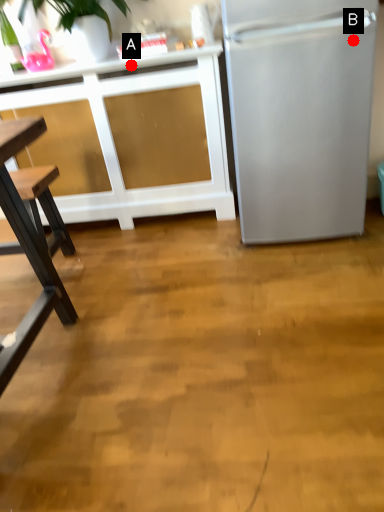
Question: Two points are circled on the image, labeled by A and B beside each circle. Which point is farther to the camera?

Choices:
 (A) A is further
 (B) B is further

Answer: (A)